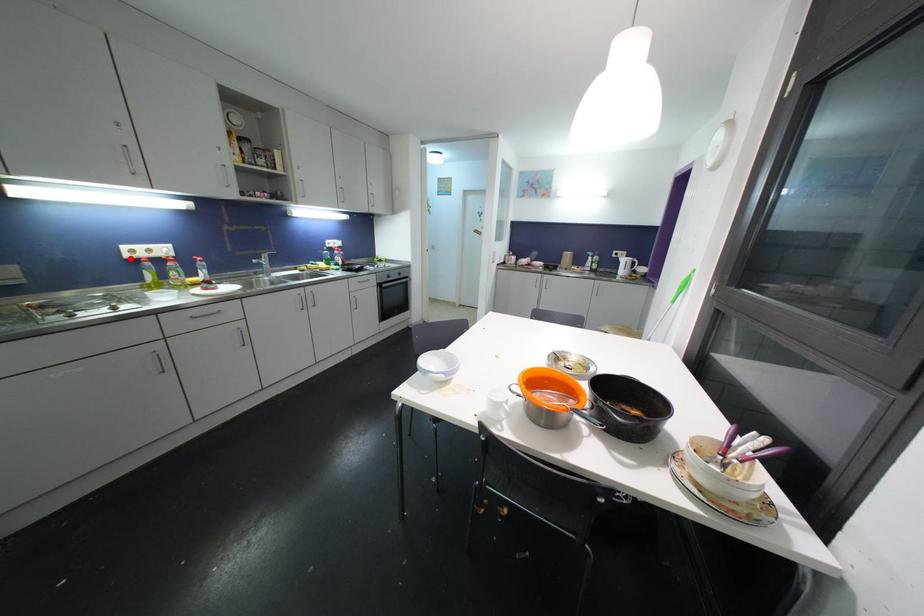
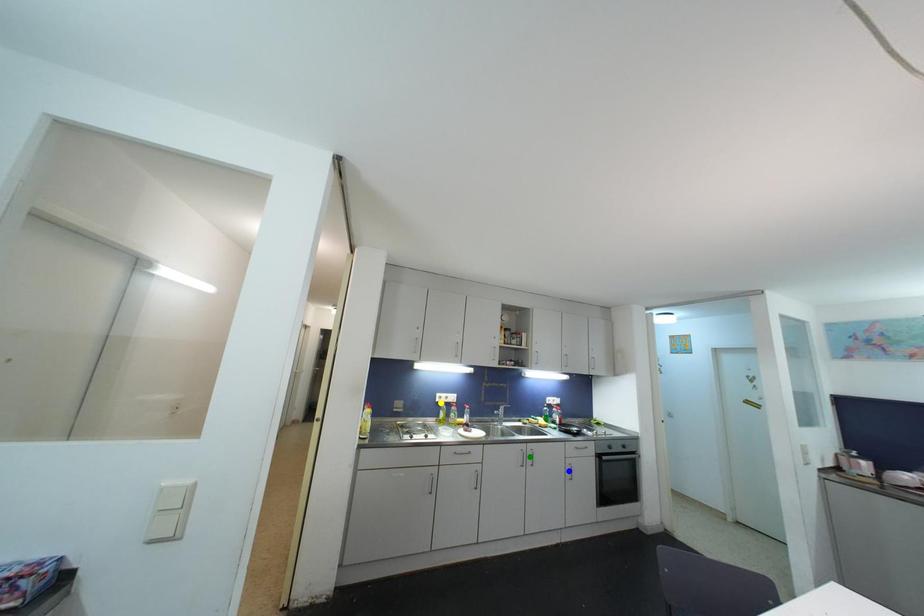
Question: I am providing you with two images of the same scene from different viewpoints. A red point is marked on the first image. You are given multiple points on the second image. Can you choose the point in image 2 that corresponds to the point in image 1?

Choices:
 (A) green point
 (B) yellow point
 (C) blue point

Answer: (B)